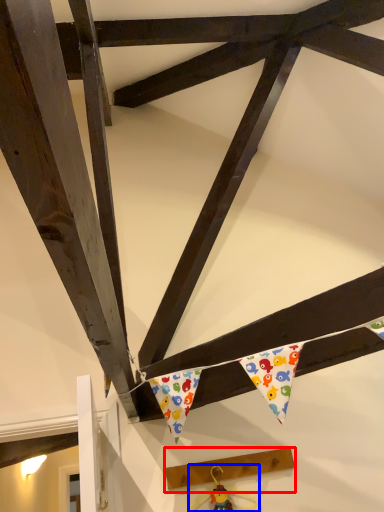
Question: Which object appears farthest to the camera in this image, plank (highlighted by a red box) or toy (highlighted by a blue box)?

Choices:
 (A) plank
 (B) toy

Answer: (A)